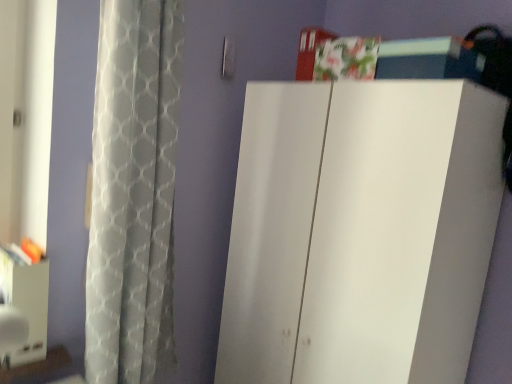
What is the approximate height of white matte cabinet at center?

4.92 feet.

What do you see at coordinates (360, 232) in the screenshot?
I see `white matte cabinet at center` at bounding box center [360, 232].

Identify the location of white matte cabinet at center. The height and width of the screenshot is (384, 512). (360, 232).

Where is `white matte cabinet at center`? white matte cabinet at center is located at coordinates (360, 232).